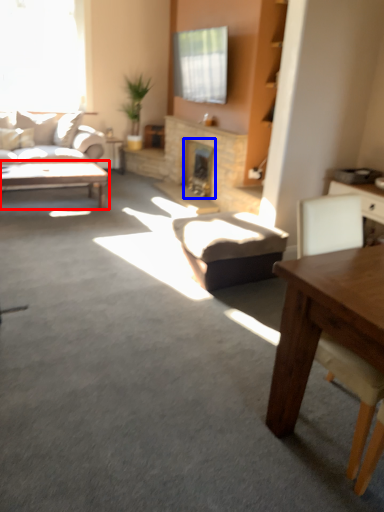
Question: Which point is further to the camera, coffee table (highlighted by a red box) or fireplace (highlighted by a blue box)?

Choices:
 (A) coffee table
 (B) fireplace

Answer: (B)